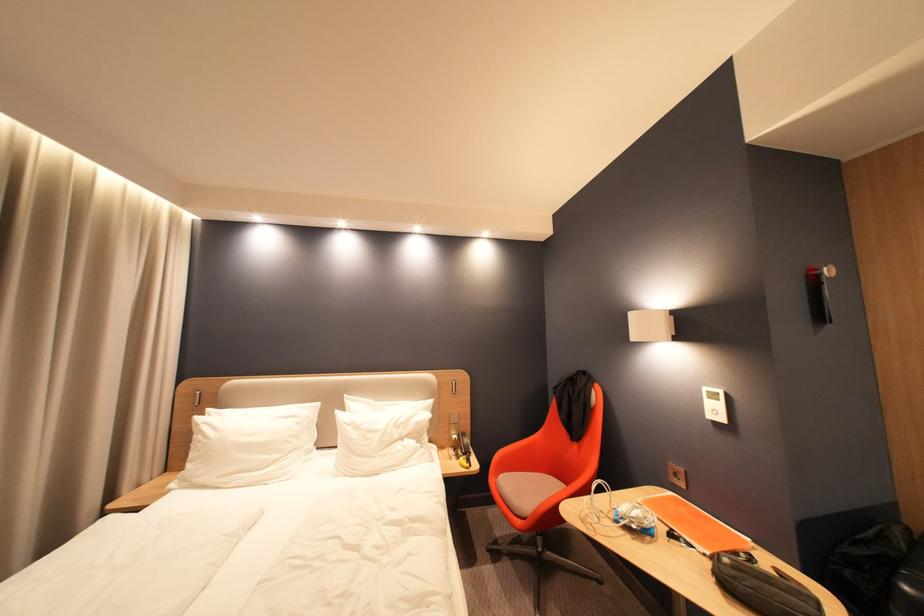
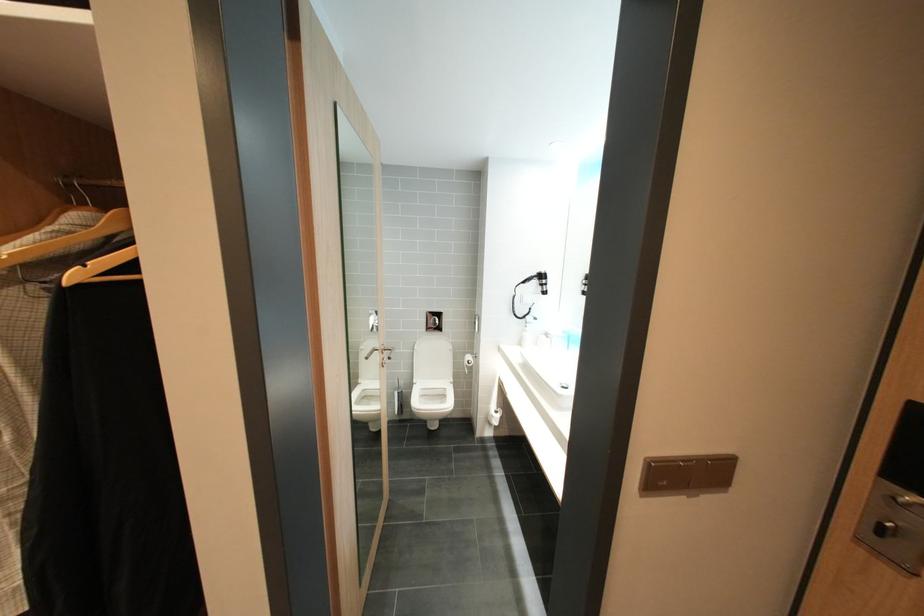
Question: I am providing you with two images of the same scene from different viewpoints. After the viewpoint changes to image2, which objects are now occluded?

Choices:
 (A) white tape dispenser
 (B) toilet paper roll
 (C) white control panel
 (D) wall-mounted flush button

Answer: (C)